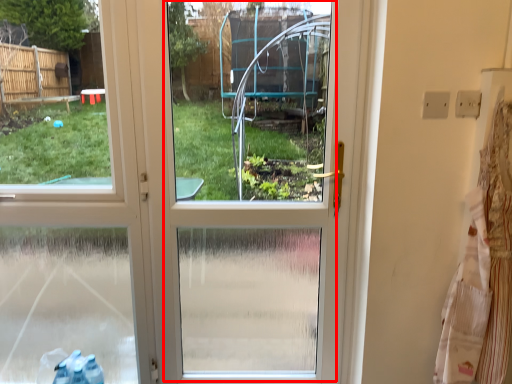
Question: From the image's perspective, what is the correct spatial positioning of screen door (annotated by the red box) in reference to laundry?

Choices:
 (A) above
 (B) below

Answer: (A)